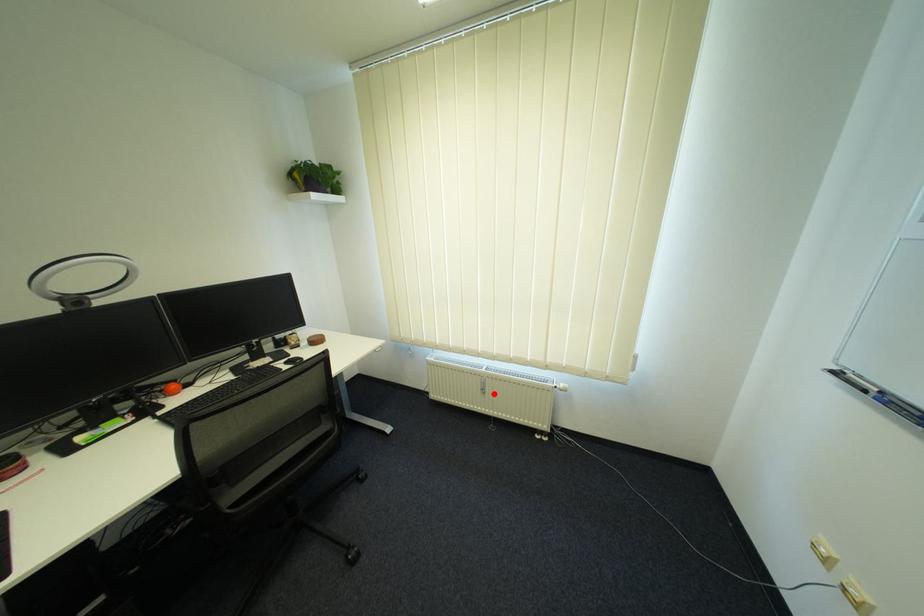
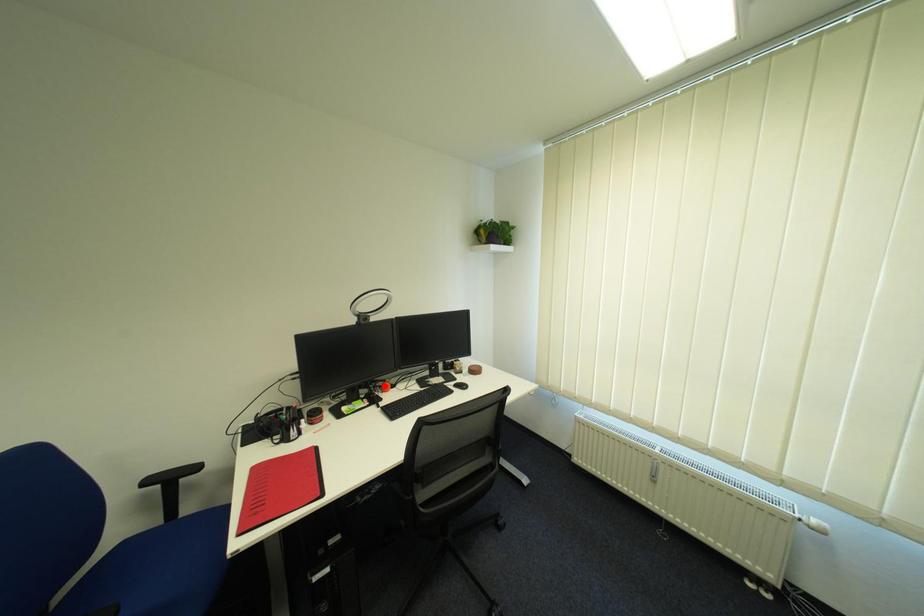
I am providing you with two images of the same scene from different viewpoints. A red point is marked on the first image and another point is marked on the second image. Are the points marked in image1 and image2 representing the same 3D position?

No